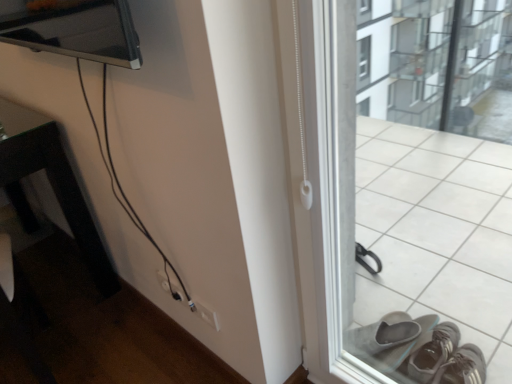
Question: In which direction should I rotate to look at white plastic electric outlet at lower center?

Choices:
 (A) left
 (B) right

Answer: (A)

Question: Does white plastic electric outlet at lower center have a smaller size compared to white plastic window frame at right?

Choices:
 (A) yes
 (B) no

Answer: (A)

Question: Considering the relative sizes of white plastic electric outlet at lower center and white plastic window frame at right in the image provided, is white plastic electric outlet at lower center shorter than white plastic window frame at right?

Choices:
 (A) no
 (B) yes

Answer: (B)

Question: Can you confirm if white plastic electric outlet at lower center is positioned to the right of white plastic window frame at right?

Choices:
 (A) no
 (B) yes

Answer: (A)

Question: From the image's perspective, is white plastic electric outlet at lower center over white plastic window frame at right?

Choices:
 (A) yes
 (B) no

Answer: (B)

Question: From a real-world perspective, is white plastic electric outlet at lower center located beneath white plastic window frame at right?

Choices:
 (A) no
 (B) yes

Answer: (B)

Question: Is white plastic electric outlet at lower center behind white plastic window frame at right?

Choices:
 (A) yes
 (B) no

Answer: (A)

Question: Can you confirm if black glossy table at left is shorter than white plastic window frame at right?

Choices:
 (A) no
 (B) yes

Answer: (B)

Question: Is black glossy table at left positioned behind white plastic window frame at right?

Choices:
 (A) no
 (B) yes

Answer: (B)

Question: Is the position of black glossy table at left less distant than that of white plastic window frame at right?

Choices:
 (A) no
 (B) yes

Answer: (A)

Question: From the image's perspective, does black glossy table at left appear lower than white plastic window frame at right?

Choices:
 (A) no
 (B) yes

Answer: (A)

Question: From the image's perspective, is black glossy table at left on top of white plastic window frame at right?

Choices:
 (A) no
 (B) yes

Answer: (B)

Question: Is white plastic window frame at right inside black glossy table at left?

Choices:
 (A) yes
 (B) no

Answer: (B)

Question: Does white plastic window frame at right contain black glossy table at left?

Choices:
 (A) no
 (B) yes

Answer: (A)